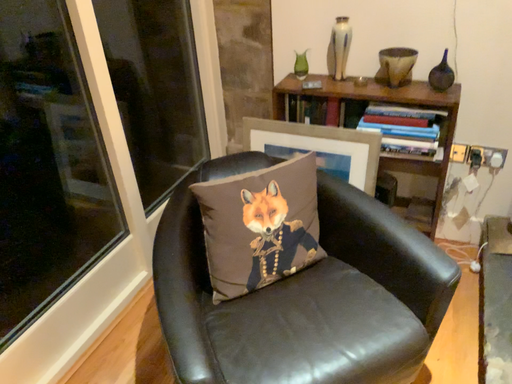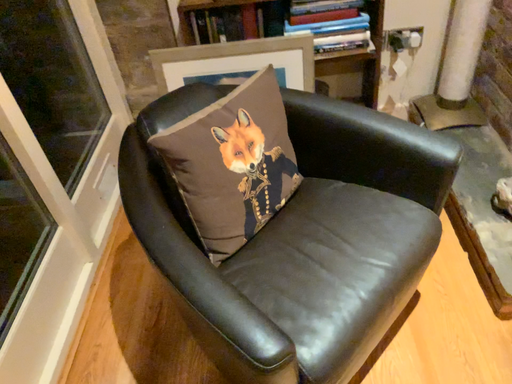
Question: Which way did the camera rotate in the video?

Choices:
 (A) rotated right
 (B) rotated left

Answer: (A)